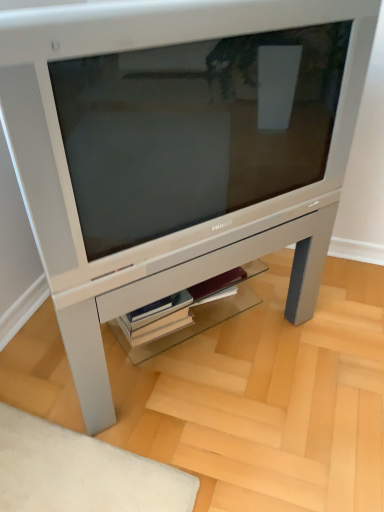
What are the coordinates of `vacant region to the right of satin silver table at center` in the screenshot? It's located at (329, 339).